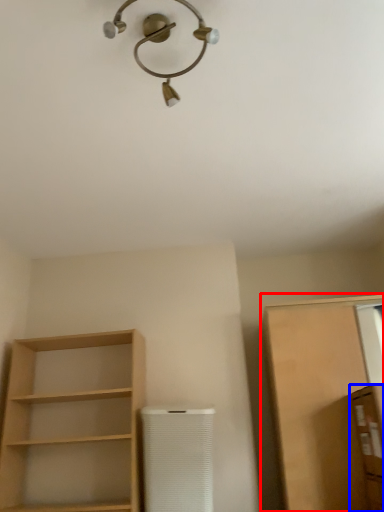
Question: Which object appears farthest to the camera in this image, cabinetry (highlighted by a red box) or cabinetry (highlighted by a blue box)?

Choices:
 (A) cabinetry
 (B) cabinetry

Answer: (A)